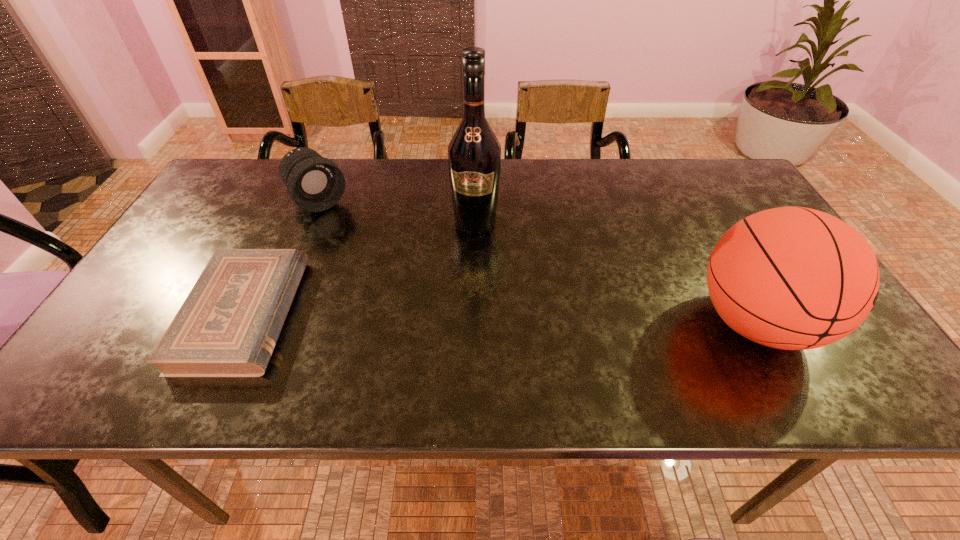
You are a GUI agent. You are given a task and a screenshot of the screen. Output one action in this format:
    pyautogui.click(x=<x>, y=<y>)
    Task: Click on the free spot on the desktop that is between the Bible and the second tallest object and is positioned on the label of the second object from right to left
    This screenshot has width=960, height=540.
    Given the screenshot: What is the action you would take?
    pyautogui.click(x=462, y=318)

Identify the location of vacant spot on the desktop that is between the shortest object and the rightmost object and is positioned at the front element of the second shortest object. This screenshot has width=960, height=540. (423, 317).